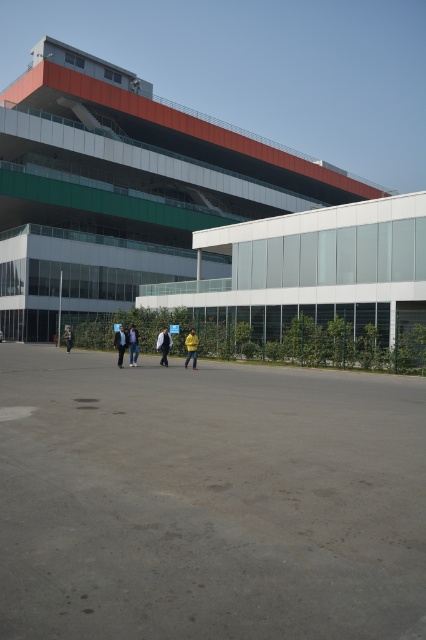
Does yellow fabric jacket at center have a lesser width compared to yellow jacket at center?

Yes, yellow fabric jacket at center is thinner than yellow jacket at center.

Looking at this image, is the position of yellow fabric jacket at center more distant than that of yellow jacket at center?

No.

Who is more forward, (169, 336) or (66, 344)?

Point (169, 336) is more forward.

Image resolution: width=426 pixels, height=640 pixels. What are the coordinates of `yellow fabric jacket at center` in the screenshot? It's located at (164, 344).

Is yellow matte jacket at center smaller than blue denim jacket at center?

Actually, yellow matte jacket at center might be larger than blue denim jacket at center.

Does point (184, 364) come in front of point (135, 349)?

No, (184, 364) is further to viewer.

The width and height of the screenshot is (426, 640). I want to click on yellow matte jacket at center, so click(x=192, y=348).

What are the coordinates of `yellow matte jacket at center` in the screenshot? It's located at (192, 348).

Is blue denim jacket at center below yellow jacket at center?

Indeed, blue denim jacket at center is positioned under yellow jacket at center.

Consider the image. Which of these two, blue denim jacket at center or yellow jacket at center, stands taller?

blue denim jacket at center

What do you see at coordinates (132, 344) in the screenshot? The width and height of the screenshot is (426, 640). I see `blue denim jacket at center` at bounding box center [132, 344].

Identify the location of blue denim jacket at center. (132, 344).